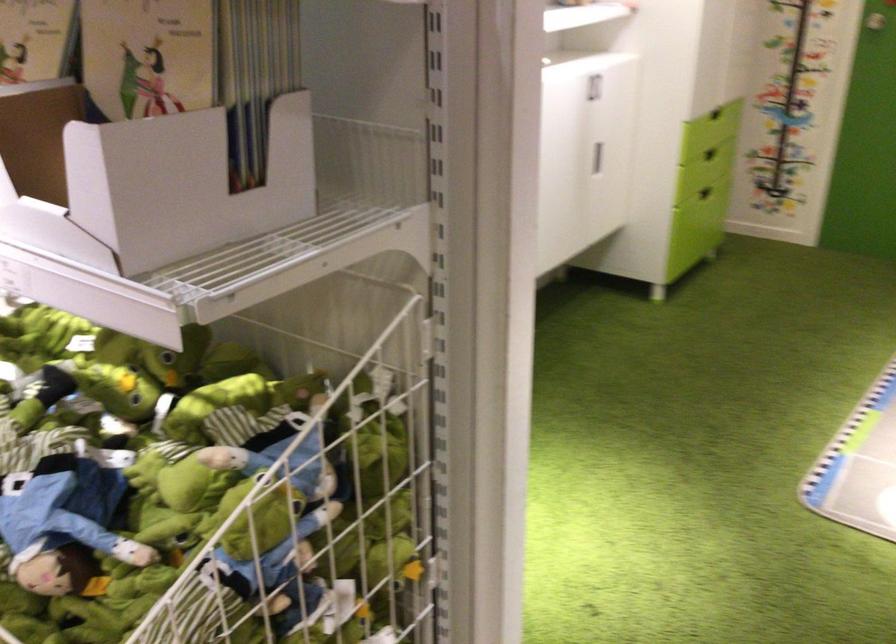
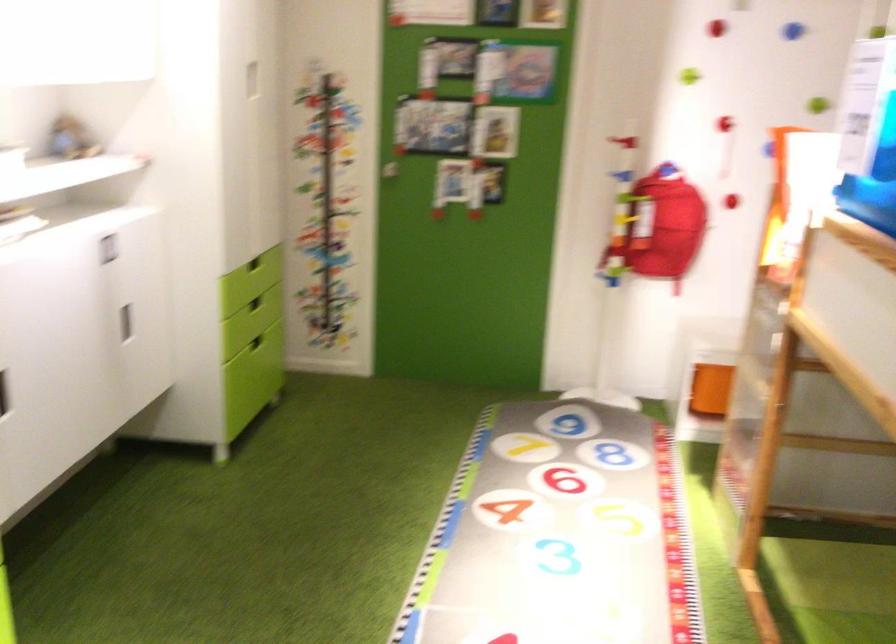
Where in the second image is the point corresponding to (714,191) from the first image?

(255, 342)